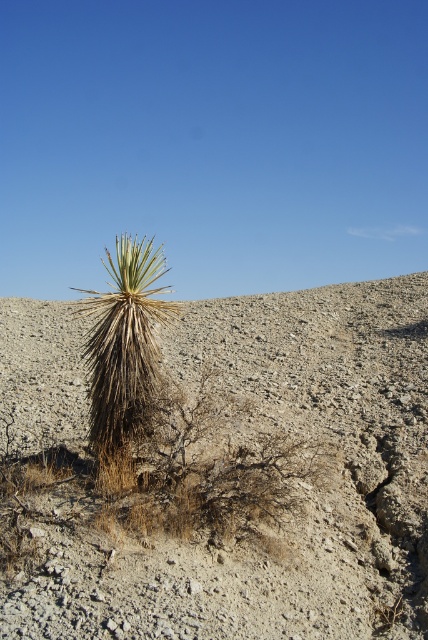
Question: Is brown/dry soil at center above brown/dry grass at center?

Choices:
 (A) yes
 (B) no

Answer: (B)

Question: Which point is farther to the camera?

Choices:
 (A) brown/dry soil at center
 (B) brown/dry grass at center

Answer: (A)

Question: Can you confirm if brown/dry soil at center is thinner than brown/dry grass at center?

Choices:
 (A) no
 (B) yes

Answer: (B)

Question: Which point appears farthest from the camera in this image?

Choices:
 (A) (395, 540)
 (B) (122, 420)

Answer: (B)

Question: Which object is closer to the camera taking this photo?

Choices:
 (A) brown/dry grass at center
 (B) brown/dry soil at center

Answer: (A)

Question: Can you confirm if brown/dry soil at center is positioned above brown/dry grass at center?

Choices:
 (A) no
 (B) yes

Answer: (A)